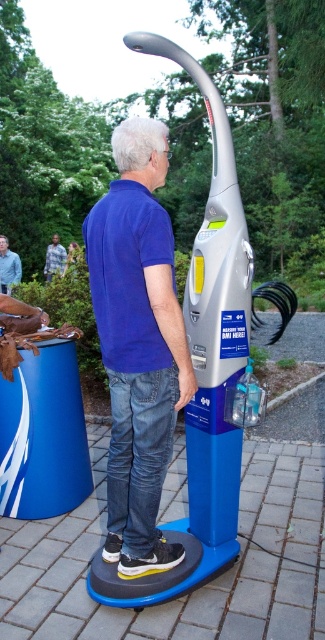
Question: Which of the following is the farthest from the observer?

Choices:
 (A) (7, 253)
 (B) (60, 248)

Answer: (B)

Question: Among these points, which one is farthest from the camera?

Choices:
 (A) (121, 314)
 (B) (48, 275)
 (C) (5, 259)

Answer: (B)

Question: Can you confirm if blue matte shirt at center is bigger than blue shirt at upper center?

Choices:
 (A) yes
 (B) no

Answer: (A)

Question: Observing the image, what is the correct spatial positioning of blue matte shirt at center in reference to green textured shirt at center?

Choices:
 (A) left
 (B) right

Answer: (B)

Question: Can you confirm if blue shirt at upper center is thinner than green textured shirt at center?

Choices:
 (A) yes
 (B) no

Answer: (A)

Question: Based on their relative distances, which object is farther from the blue matte shirt at center?

Choices:
 (A) blue shirt at upper center
 (B) green textured shirt at center

Answer: (B)